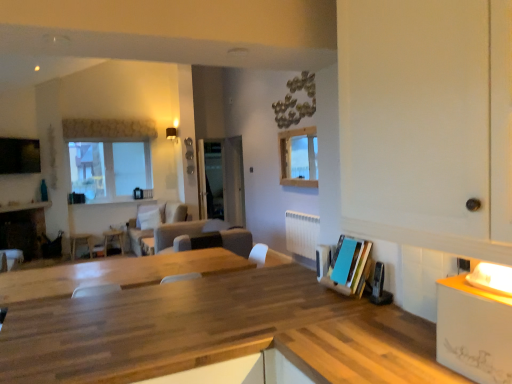
Question: In which direction should I rotate to look at suede beige couch at center, arranged as the second couch when viewed from the front?

Choices:
 (A) left
 (B) right

Answer: (A)

Question: Is transparent glass door at center at the left side of white plastic radiator at center?

Choices:
 (A) yes
 (B) no

Answer: (A)

Question: Is transparent glass door at center closer to the viewer compared to white plastic radiator at center?

Choices:
 (A) no
 (B) yes

Answer: (A)

Question: From the image's perspective, would you say transparent glass door at center is positioned over white plastic radiator at center?

Choices:
 (A) yes
 (B) no

Answer: (A)

Question: Considering the relative sizes of transparent glass door at center and white plastic radiator at center in the image provided, is transparent glass door at center taller than white plastic radiator at center?

Choices:
 (A) yes
 (B) no

Answer: (A)

Question: Considering the relative sizes of transparent glass door at center and white plastic radiator at center in the image provided, is transparent glass door at center thinner than white plastic radiator at center?

Choices:
 (A) yes
 (B) no

Answer: (B)

Question: Is transparent glass door at center touching white plastic radiator at center?

Choices:
 (A) yes
 (B) no

Answer: (B)

Question: Is matte black fireplace at left to the left of white plastic radiator at center from the viewer's perspective?

Choices:
 (A) no
 (B) yes

Answer: (B)

Question: Does matte black fireplace at left have a lesser height compared to white plastic radiator at center?

Choices:
 (A) no
 (B) yes

Answer: (A)

Question: Does matte black fireplace at left have a larger size compared to white plastic radiator at center?

Choices:
 (A) no
 (B) yes

Answer: (B)

Question: From the image's perspective, is matte black fireplace at left over white plastic radiator at center?

Choices:
 (A) yes
 (B) no

Answer: (B)

Question: From a real-world perspective, is matte black fireplace at left physically above white plastic radiator at center?

Choices:
 (A) no
 (B) yes

Answer: (A)

Question: Would you say matte black fireplace at left is outside white plastic radiator at center?

Choices:
 (A) yes
 (B) no

Answer: (A)

Question: From the image's perspective, is suede beige couch at center, the 1th couch from the back, on suede-like gray couch at center, which appears as the second couch when viewed from the back?

Choices:
 (A) no
 (B) yes

Answer: (B)